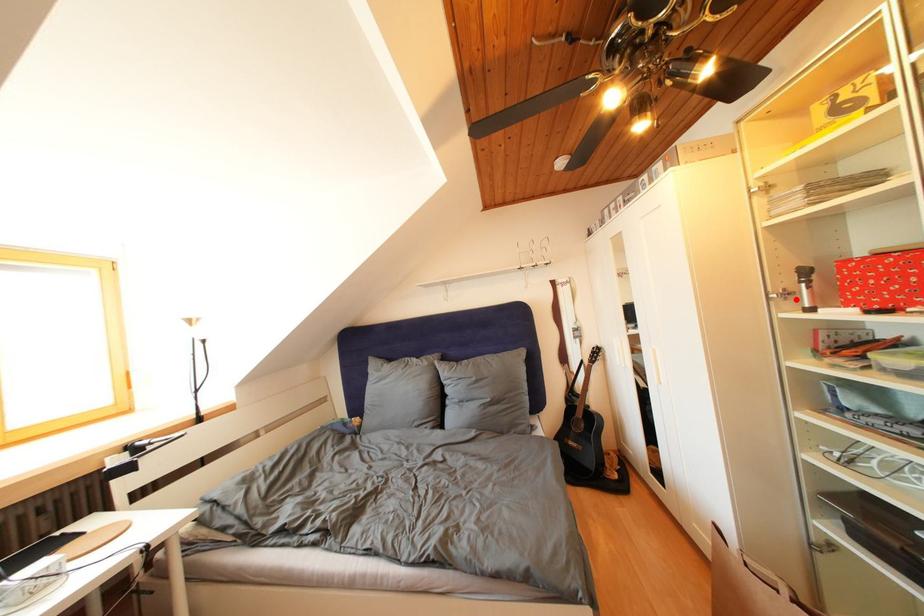
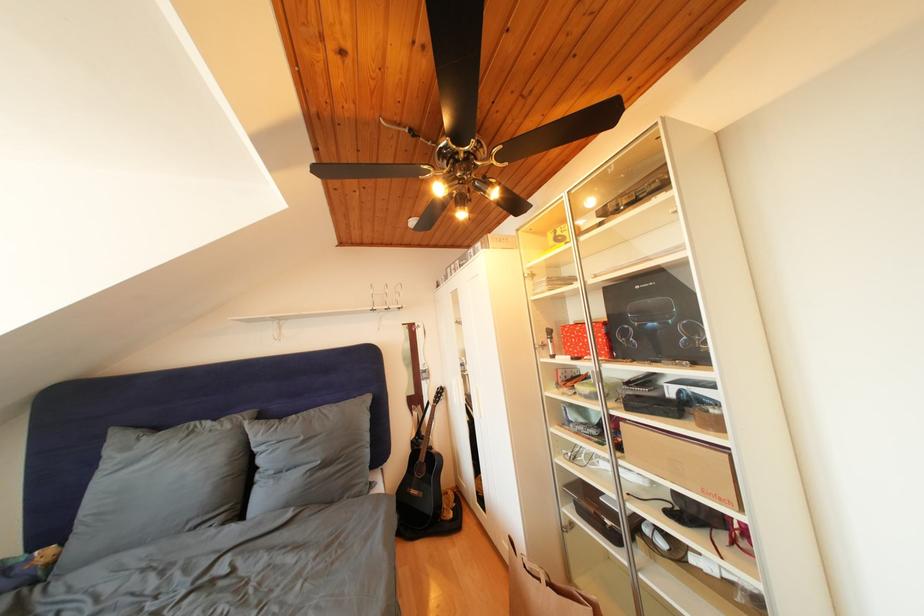
The point at the highlighted location is marked in the first image. Where is the corresponding point in the second image?

(552, 351)